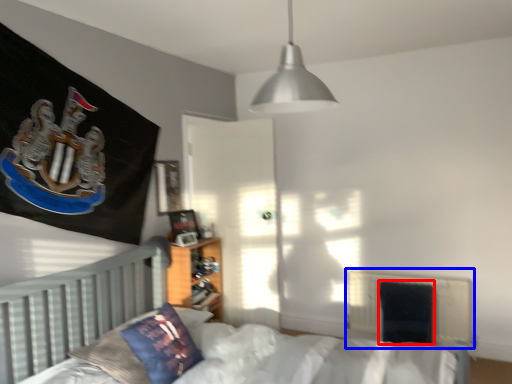
Question: Which object is further to the camera taking this photo, armchair (highlighted by a red box) or radiator (highlighted by a blue box)?

Choices:
 (A) armchair
 (B) radiator

Answer: (A)